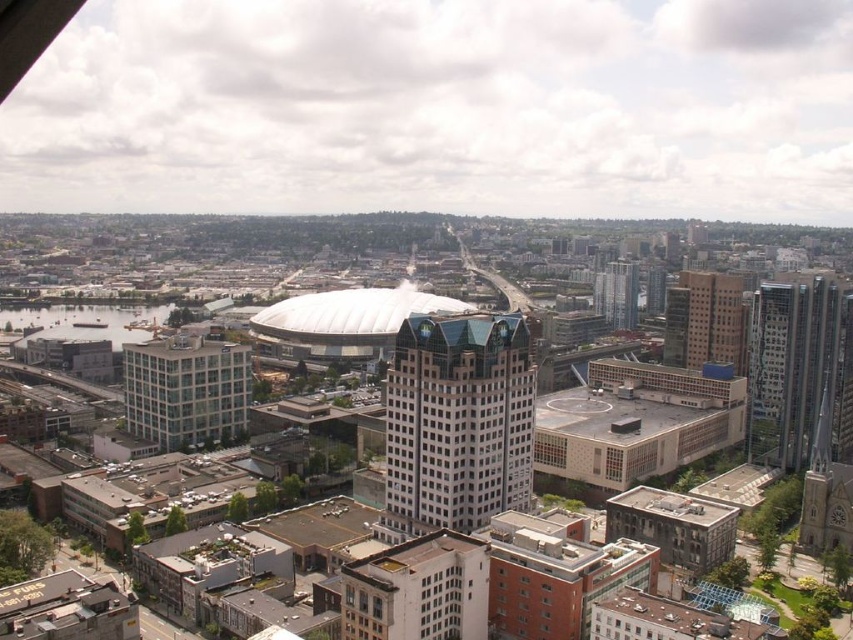
Question: Which object appears farthest from the camera in this image?

Choices:
 (A) glassy skyscraper at center-right
 (B) white glass building at center

Answer: (A)

Question: Which of the following is the closest to the observer?

Choices:
 (A) (653, 300)
 (B) (805, 456)

Answer: (B)

Question: Can you confirm if beige concrete building at center is wider than glassy skyscraper at center-right?

Choices:
 (A) no
 (B) yes

Answer: (B)

Question: In this image, where is glassy steel skyscraper at right located relative to glassy steel skyscraper at center-right?

Choices:
 (A) below
 (B) above

Answer: (A)

Question: Which of the following is the farthest from the observer?

Choices:
 (A) glassy steel skyscraper at center-right
 (B) clear glass building at center
 (C) white glass building at center

Answer: (A)

Question: Is clear glass building at center further to camera compared to glassy steel skyscraper at center-right?

Choices:
 (A) yes
 (B) no

Answer: (B)